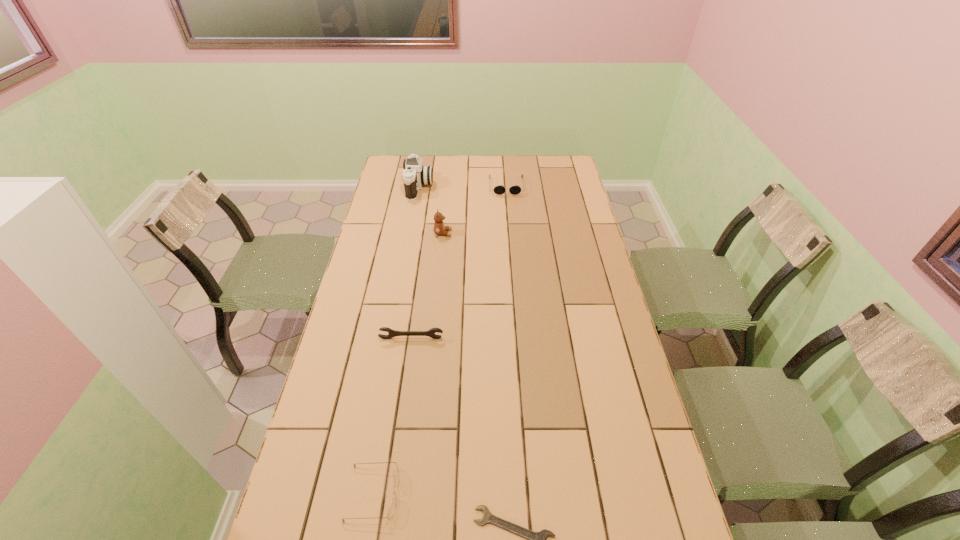
The height and width of the screenshot is (540, 960). Identify the location of vacant space located on the open ends of the taller wrench. (404, 386).

Where is `vacant region located 0.110m on the front-facing side of the fifth tallest object`? This screenshot has width=960, height=540. vacant region located 0.110m on the front-facing side of the fifth tallest object is located at coordinates (444, 493).

Locate an element on the screen. camera at the far edge is located at coordinates (415, 175).

Where is `sunglasses that is at the far edge`? This screenshot has height=540, width=960. sunglasses that is at the far edge is located at coordinates (498, 189).

The image size is (960, 540). Find the location of `camera at the left edge`. camera at the left edge is located at coordinates click(x=415, y=175).

Find the location of a particular element. This screenshot has height=540, width=960. wrench present at the left edge is located at coordinates (392, 333).

Identify the location of spectacles positioned at the left edge. The height and width of the screenshot is (540, 960). (391, 510).

Locate an element on the screen. This screenshot has width=960, height=540. object that is at the far left corner is located at coordinates (415, 175).

The image size is (960, 540). I want to click on free point at the far edge, so click(479, 179).

Identify the location of free space at the left edge. The image size is (960, 540). (330, 428).